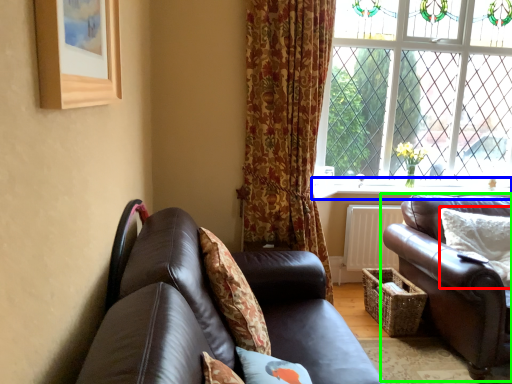
Question: Considering the real-world distances, which object is closest to pillow (highlighted by a red box)? window sill (highlighted by a blue box) or studio couch (highlighted by a green box).

Choices:
 (A) window sill
 (B) studio couch

Answer: (B)